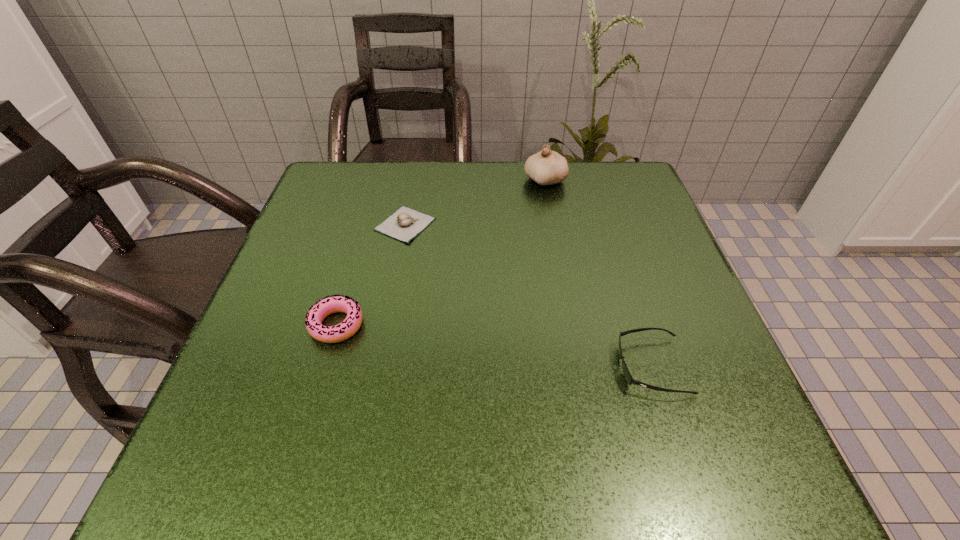
This screenshot has height=540, width=960. I want to click on blank space at the near right corner of the desktop, so click(x=656, y=452).

The height and width of the screenshot is (540, 960). In order to click on free point between the doughnut and the right garlic in this screenshot , I will do `click(441, 253)`.

Where is `free spot between the rightmost object and the doughnut`? The image size is (960, 540). free spot between the rightmost object and the doughnut is located at coordinates (493, 346).

In order to click on free space between the doughnut and the taller garlic in this screenshot , I will do `click(441, 253)`.

Find the location of a particular element. free space between the doughnut and the left garlic is located at coordinates (371, 274).

Find the location of a particular element. The height and width of the screenshot is (540, 960). free spot between the sunglasses and the third nearest object is located at coordinates (528, 295).

The height and width of the screenshot is (540, 960). Identify the location of free space between the doughnut and the tallest object. (441, 253).

At what (x,y) coordinates should I click in order to perform the action: click on free space between the rightmost object and the doughnut. Please return your answer as a coordinate pair (x, y). The width and height of the screenshot is (960, 540). Looking at the image, I should click on (493, 346).

You are a GUI agent. You are given a task and a screenshot of the screen. Output one action in this format:
    pyautogui.click(x=<x>, y=<y>)
    Task: Click on the unoccupied position between the shortest object and the rightmost object
    The image size is (960, 540).
    Given the screenshot: What is the action you would take?
    pyautogui.click(x=528, y=295)

Find the location of a particular element. The width and height of the screenshot is (960, 540). vacant space in between the rightmost object and the doughnut is located at coordinates (493, 346).